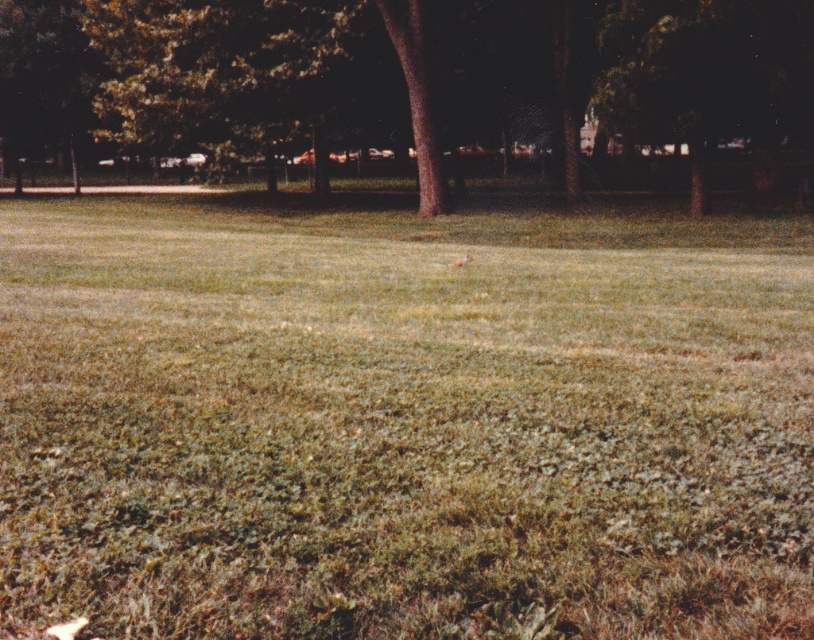
Question: Is brown textured tree at center smaller than green leafy tree at center?

Choices:
 (A) no
 (B) yes

Answer: (A)

Question: Which of these objects is positioned closest to the green leafy tree at center?

Choices:
 (A) brown rough bark tree at center
 (B) brown textured tree at center
 (C) green grassy field at center

Answer: (B)

Question: Which object is farther from the camera taking this photo?

Choices:
 (A) green grassy field at center
 (B) brown textured tree at center
 (C) green leafy tree at center

Answer: (B)

Question: Which of these objects is positioned farthest from the green grassy field at center?

Choices:
 (A) brown rough bark tree at center
 (B) green leafy tree at center

Answer: (A)

Question: Can you confirm if brown textured tree at center is wider than brown rough bark tree at center?

Choices:
 (A) yes
 (B) no

Answer: (A)

Question: Can you confirm if green grassy field at center is positioned above green leafy tree at center?

Choices:
 (A) no
 (B) yes

Answer: (A)